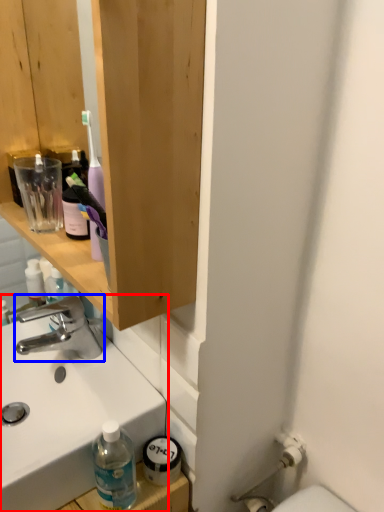
Question: Which of the following is the farthest to the observer, sink (highlighted by a red box) or tap (highlighted by a blue box)?

Choices:
 (A) sink
 (B) tap

Answer: (B)